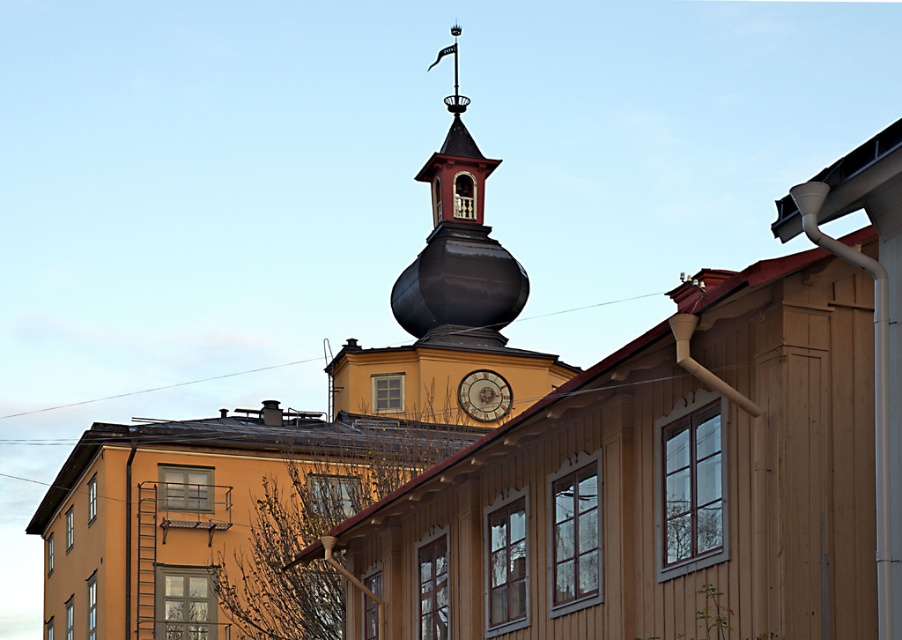
You are an architect reviewing a blueprint of the building shown in the image. The blueprint shows a point marked at coordinates (x=458, y=246). What does this point correspond to in the actual building?

The point at coordinates (x=458, y=246) corresponds to the shiny dark brown bell tower at upper center.